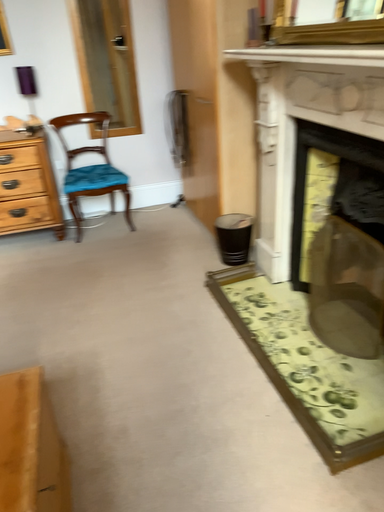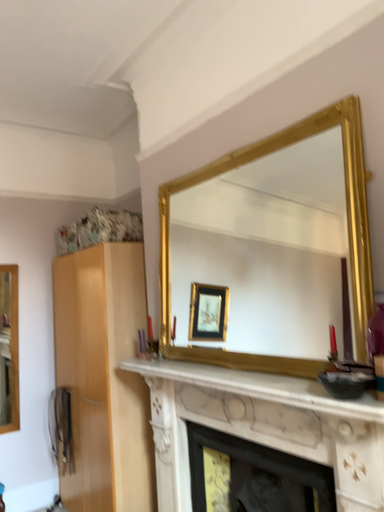
Question: How did the camera likely rotate when shooting the video?

Choices:
 (A) rotated upward
 (B) rotated downward

Answer: (A)